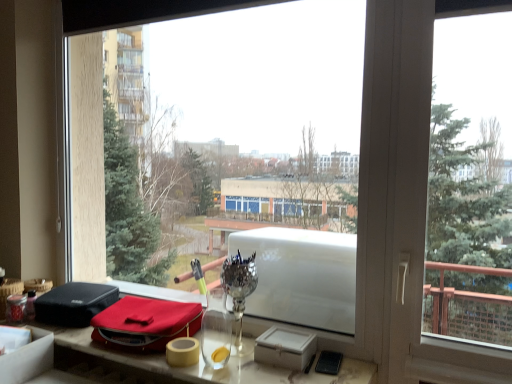
This screenshot has width=512, height=384. Find the location of `matte red bag at lower center`. matte red bag at lower center is located at coordinates (157, 365).

The width and height of the screenshot is (512, 384). Describe the element at coordinates (157, 365) in the screenshot. I see `matte red bag at lower center` at that location.

At what (x,y) coordinates should I click in order to perform the action: click on velvet red pouch at lower left. Please return your answer as a coordinate pair (x, y). This screenshot has width=512, height=384. Looking at the image, I should click on (145, 323).

The image size is (512, 384). What do you see at coordinates (145, 323) in the screenshot? I see `velvet red pouch at lower left` at bounding box center [145, 323].

Locate an element on the screen. The width and height of the screenshot is (512, 384). matte red bag at lower center is located at coordinates (157, 365).

Based on their positions, is matte red bag at lower center located to the left or right of velvet red pouch at lower left?

matte red bag at lower center is positioned on velvet red pouch at lower left's right side.

Considering the positions of objects matte red bag at lower center and velvet red pouch at lower left in the image provided, who is behind, matte red bag at lower center or velvet red pouch at lower left?

velvet red pouch at lower left is behind.

Is point (239, 359) positioned behind point (160, 300)?

No, (239, 359) is in front of (160, 300).

From the image's perspective, who appears lower, matte red bag at lower center or velvet red pouch at lower left?

From the image's view, matte red bag at lower center is below.

From a real-world perspective, between matte red bag at lower center and velvet red pouch at lower left, who is vertically higher?

From a 3D spatial view, velvet red pouch at lower left is above.

Can you confirm if matte red bag at lower center is thinner than velvet red pouch at lower left?

In fact, matte red bag at lower center might be wider than velvet red pouch at lower left.

Is matte red bag at lower center taller or shorter than velvet red pouch at lower left?

Clearly, matte red bag at lower center is shorter compared to velvet red pouch at lower left.

Who is bigger, matte red bag at lower center or velvet red pouch at lower left?

matte red bag at lower center.

Is matte red bag at lower center positioned beyond the bounds of velvet red pouch at lower left?

Absolutely, matte red bag at lower center is external to velvet red pouch at lower left.

Are matte red bag at lower center and velvet red pouch at lower left beside each other?

matte red bag at lower center and velvet red pouch at lower left are not in contact.

Could you tell me if matte red bag at lower center is facing velvet red pouch at lower left?

No.

What's the angular difference between matte red bag at lower center and velvet red pouch at lower left's facing directions?

8.91 degrees separate the facing orientations of matte red bag at lower center and velvet red pouch at lower left.

Locate an element on the screen. Image resolution: width=512 pixels, height=384 pixels. table lying in front of the velvet red pouch at lower left is located at coordinates (157, 365).

Is velvet red pouch at lower left at the left side of matte red bag at lower center?

Yes.

Is velvet red pouch at lower left in front of or behind matte red bag at lower center in the image?

velvet red pouch at lower left is positioned farther from the viewer than matte red bag at lower center.

Which is in front, point (112, 324) or point (76, 380)?

The point (112, 324) is closer to the camera.

From the picture: From the image's perspective, between velvet red pouch at lower left and matte red bag at lower center, who is located below?

matte red bag at lower center, from the image's perspective.

From a real-world perspective, is velvet red pouch at lower left positioned above or below matte red bag at lower center?

From a real-world perspective, velvet red pouch at lower left is physically above matte red bag at lower center.

Based on the photo, which object is wider, velvet red pouch at lower left or matte red bag at lower center?

With larger width is matte red bag at lower center.

Considering the sizes of velvet red pouch at lower left and matte red bag at lower center in the image, is velvet red pouch at lower left taller or shorter than matte red bag at lower center?

Considering their sizes, velvet red pouch at lower left has more height than matte red bag at lower center.

In the scene shown: Does velvet red pouch at lower left have a larger size compared to matte red bag at lower center?

No.

Can matte red bag at lower center be found inside velvet red pouch at lower left?

No, matte red bag at lower center is located outside of velvet red pouch at lower left.

Is there a large distance between velvet red pouch at lower left and matte red bag at lower center?

velvet red pouch at lower left is near matte red bag at lower center, not far away.

Looking at this image, is velvet red pouch at lower left oriented away from matte red bag at lower center?

No, velvet red pouch at lower left is not facing away from matte red bag at lower center.

How many degrees apart are the facing directions of velvet red pouch at lower left and matte red bag at lower center?

There is a 8.91-degree angle between the facing directions of velvet red pouch at lower left and matte red bag at lower center.

How much distance is there between velvet red pouch at lower left and matte red bag at lower center?

velvet red pouch at lower left is 5.72 inches away from matte red bag at lower center.

Find the location of a particular element. table below the velvet red pouch at lower left (from the image's perspective) is located at coordinates (157, 365).

Find the location of a particular element. This screenshot has width=512, height=384. material that is behind the matte red bag at lower center is located at coordinates (145, 323).

I want to click on material above the matte red bag at lower center (from the image's perspective), so click(145, 323).